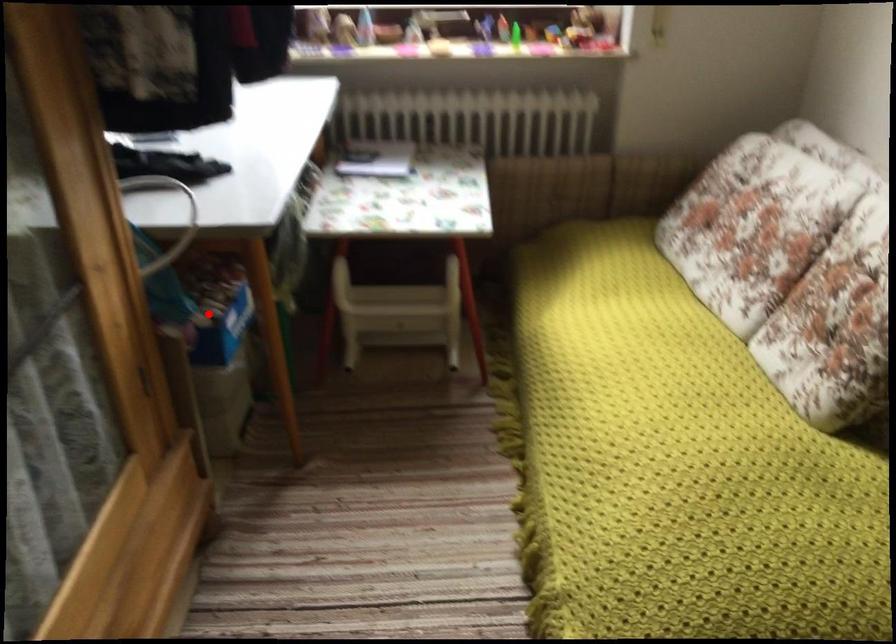
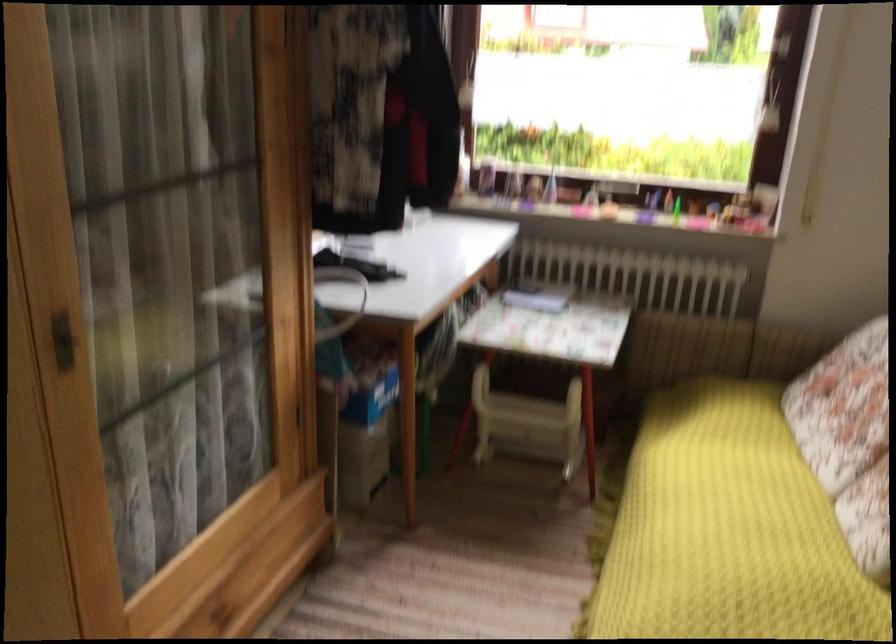
Question: I am providing you with two images of the same scene from different viewpoints. A red point is marked on the first image. Is the red point's position out of view in image 2?

Choices:
 (A) Yes
 (B) No

Answer: (B)